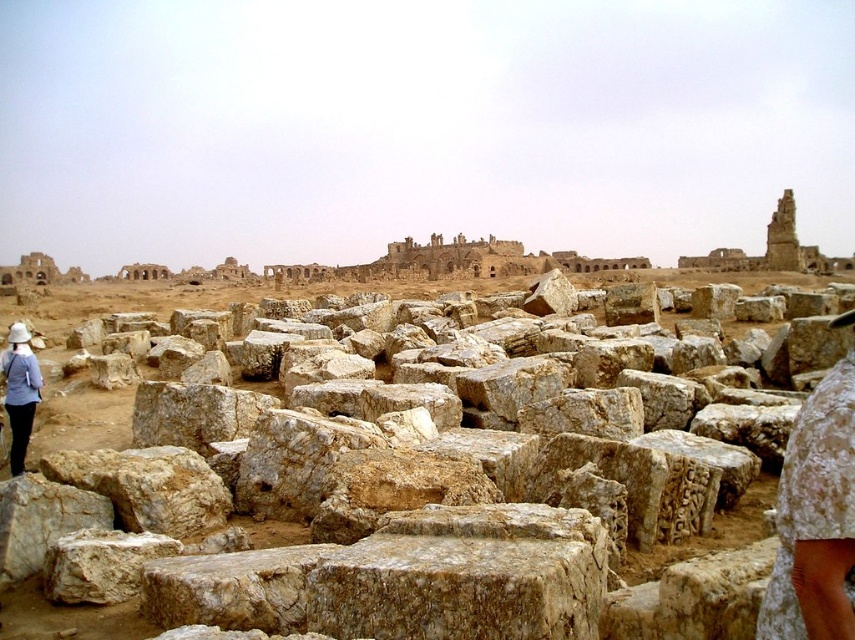
Who is lower down, natural stone blocks at center or light blue fabric hat at left?

natural stone blocks at center

Between natural stone blocks at center and light blue fabric hat at left, which one appears on the right side from the viewer's perspective?

natural stone blocks at center

Is point (352, 413) positioned behind point (24, 355)?

No.

Image resolution: width=855 pixels, height=640 pixels. I want to click on natural stone blocks at center, so click(452, 600).